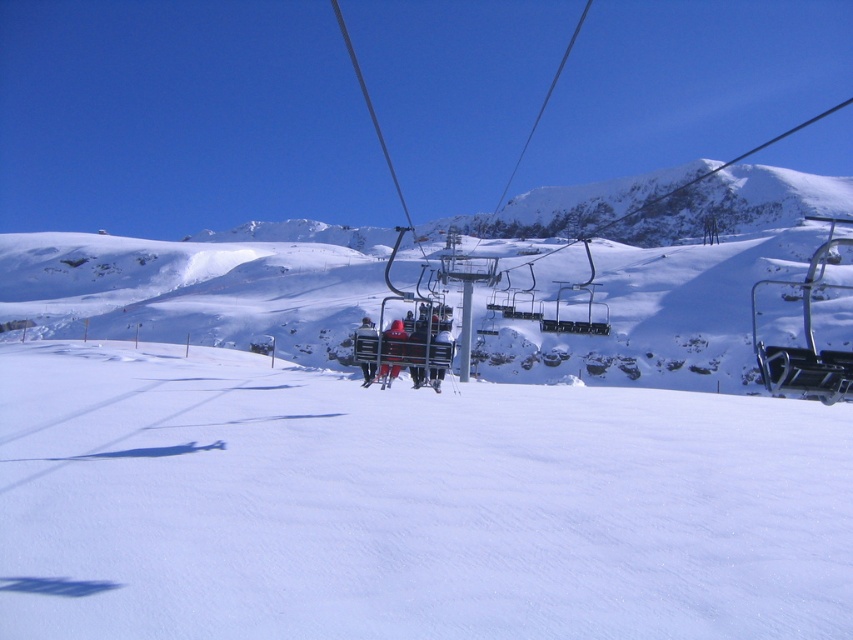
Question: Which point appears closest to the camera in this image?

Choices:
 (A) (412, 333)
 (B) (401, 337)
 (C) (341, 417)

Answer: (B)

Question: Is red fabric jacket at center above black fabric jacket at center?

Choices:
 (A) no
 (B) yes

Answer: (B)

Question: Is red fabric jacket at center bigger than matte black ski suit at center?

Choices:
 (A) no
 (B) yes

Answer: (B)

Question: Which of these objects is positioned closest to the white powdery snow at center?

Choices:
 (A) red fabric jacket at center
 (B) black fabric jacket at center
 (C) matte red jacket at center
 (D) matte black ski suit at center

Answer: (A)

Question: Can you confirm if matte red jacket at center is positioned to the right of black fabric jacket at center?

Choices:
 (A) no
 (B) yes

Answer: (A)

Question: Which object is farther from the camera taking this photo?

Choices:
 (A) black fabric jacket at center
 (B) red fabric jacket at center
 (C) matte red jacket at center
 (D) white powdery snow at center

Answer: (C)